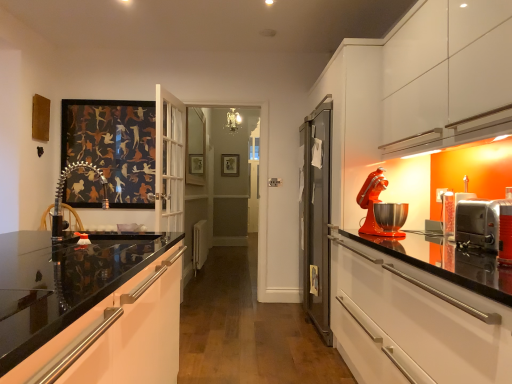
Question: Based on their sizes in the image, would you say matte orange mixer at right is bigger or smaller than stainless steel toaster oven at right, acting as the 2th appliance starting from the back?

Choices:
 (A) small
 (B) big

Answer: (B)

Question: From a real-world perspective, is matte orange mixer at right above or below stainless steel toaster oven at right, acting as the 2th appliance starting from the back?

Choices:
 (A) above
 (B) below

Answer: (A)

Question: Which of these objects is positioned farthest from the matte orange mixer at right?

Choices:
 (A) metallic silver chair at left
 (B) metallic silver toaster at right, marked as the first appliance in a back-to-front arrangement
 (C) gold metallic picture frame at center
 (D) clear glass mirror at center
 (E) stainless steel toaster oven at right, acting as the 2th appliance starting from the back

Answer: (C)

Question: Estimate the real-world distances between objects in this image. Which object is closer to the clear glass mirror at center?

Choices:
 (A) metallic silver chair at left
 (B) matte orange mixer at right
 (C) glossy white cabinet at lower left
 (D) gold metallic picture frame at center
 (E) stainless steel toaster oven at right, acting as the 2th appliance starting from the back

Answer: (D)